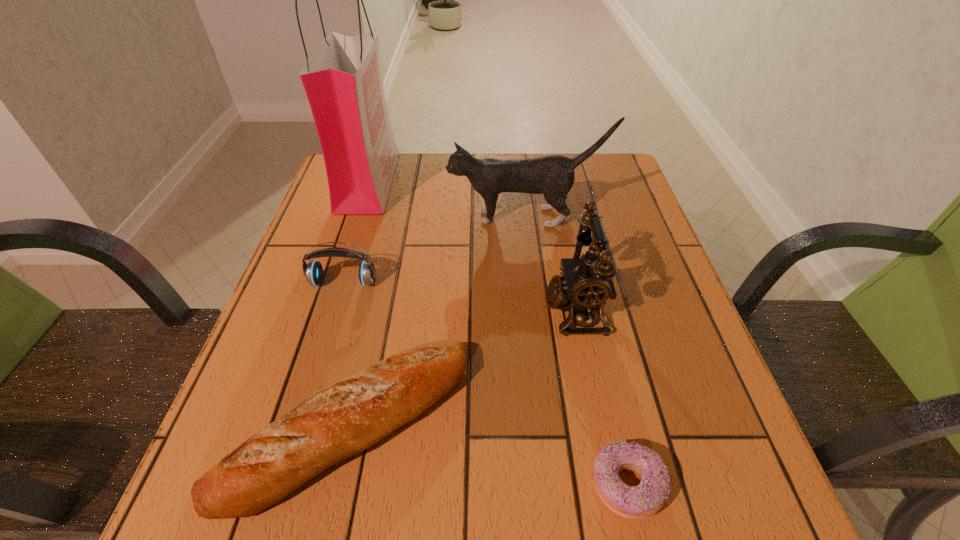
Find the location of a particular element. Image resolution: width=960 pixels, height=540 pixels. vacant space at the right edge of the desktop is located at coordinates coord(645,421).

Where is `vacant space at the near left corner of the desktop`? vacant space at the near left corner of the desktop is located at coordinates (193, 505).

The width and height of the screenshot is (960, 540). Identify the location of free space that is in between the fourth shortest object and the doughnut. (601, 397).

This screenshot has width=960, height=540. Find the location of `free space that is in between the headset and the doughnut`. free space that is in between the headset and the doughnut is located at coordinates coord(485,383).

The height and width of the screenshot is (540, 960). I want to click on vacant region between the baguet and the shortest object, so click(489, 455).

Identify the location of free space between the telephone and the second tallest object. (550, 263).

Identify the location of vacant space in between the headset and the tallest object. Image resolution: width=960 pixels, height=540 pixels. (356, 232).

Locate an element on the screen. free point between the doughnut and the third shortest object is located at coordinates (485, 383).

Locate an element on the screen. The width and height of the screenshot is (960, 540). free space between the tallest object and the shortest object is located at coordinates (497, 333).

This screenshot has width=960, height=540. In order to click on vacant area between the shopping bag and the third shortest object in this screenshot , I will do `click(356, 232)`.